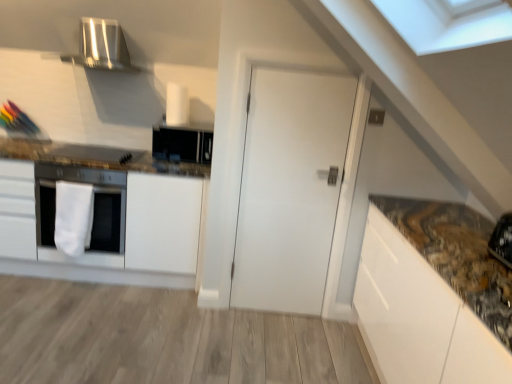
This screenshot has height=384, width=512. I want to click on free space above white matte door at center (from a real-world perspective), so point(305,65).